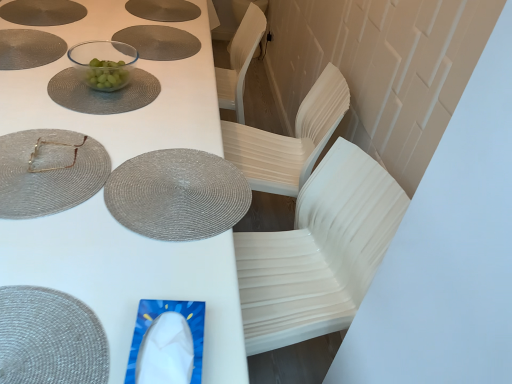
This screenshot has height=384, width=512. In order to click on vacant space in between matte silver placemat at upper left, the 1th platter in the left-to-right sequence, and matte woven placemat at upper left, positioned as the second glass plate in back-to-front order in this screenshot , I will do `click(47, 64)`.